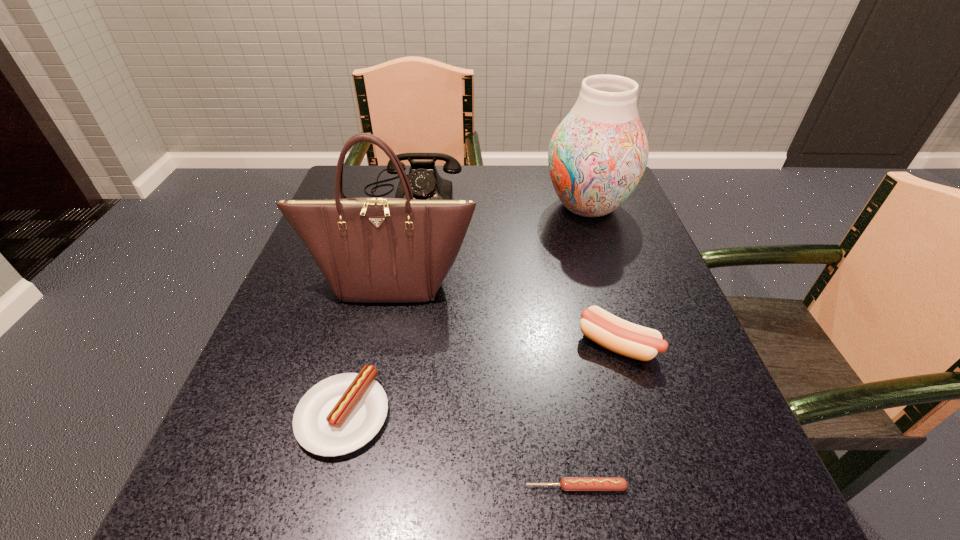
Image resolution: width=960 pixels, height=540 pixels. In order to click on sausage at the left edge in this screenshot , I will do `click(342, 413)`.

You are a GUI agent. You are given a task and a screenshot of the screen. Output one action in this format:
    pyautogui.click(x=<x>, y=<y>)
    Task: Click on the vase positioned at the right edge
    This screenshot has height=540, width=960.
    Given the screenshot: What is the action you would take?
    pyautogui.click(x=597, y=155)

At what (x,y) coordinates should I click in order to perform the action: click on sausage at the right edge. Please return your answer as a coordinate pair (x, y). Looking at the image, I should click on (625, 338).

The height and width of the screenshot is (540, 960). What are the coordinates of `object present at the far left corner` in the screenshot? It's located at (425, 182).

Find the location of a particular element. This screenshot has width=960, height=540. object that is at the far right corner is located at coordinates (597, 155).

Where is `vacant region at the far edge of the desktop`? The width and height of the screenshot is (960, 540). vacant region at the far edge of the desktop is located at coordinates (542, 180).

In the image, there is a desktop. What are the coordinates of `vacant space at the near edge` in the screenshot? It's located at (501, 536).

This screenshot has height=540, width=960. Find the location of `free space at the left edge of the desktop`. free space at the left edge of the desktop is located at coordinates (349, 332).

Locate an element on the screen. The width and height of the screenshot is (960, 540). vacant region at the right edge of the desktop is located at coordinates (634, 279).

In the image, there is a desktop. Identify the location of free space at the near left corner. (286, 533).